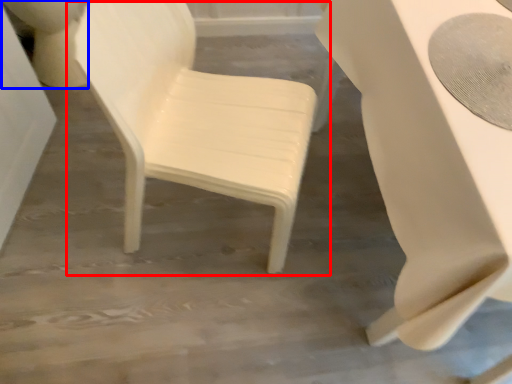
Question: Which of the following is the closest to the observer, chair (highlighted by a red box) or toilet bowl (highlighted by a blue box)?

Choices:
 (A) chair
 (B) toilet bowl

Answer: (A)